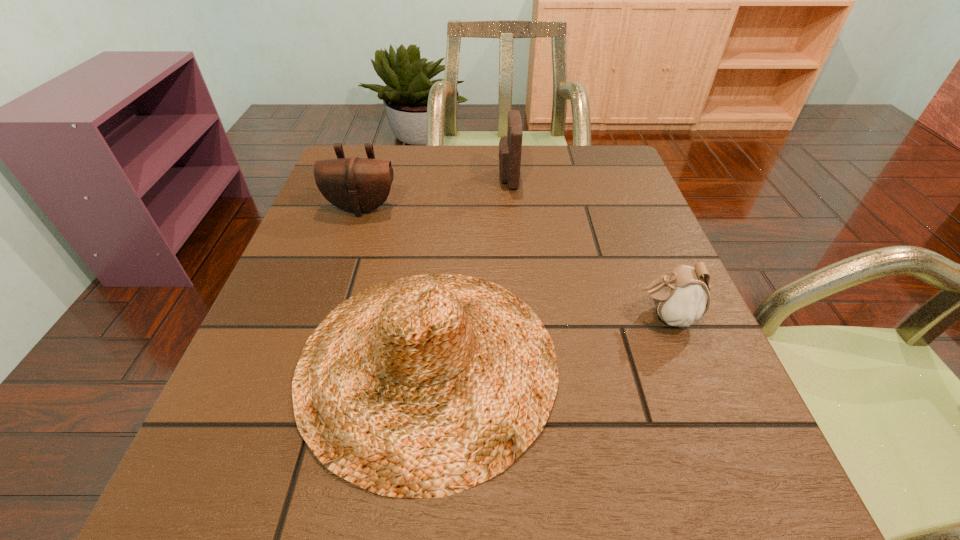
Identify the location of object that is at the near left corner. (421, 387).

In order to click on free spot at the far edge of the desktop in this screenshot , I will do `click(412, 170)`.

Find the location of a particular element. free spot at the near edge of the desktop is located at coordinates (536, 524).

Find the location of a particular element. Image resolution: width=960 pixels, height=540 pixels. free space at the left edge of the desktop is located at coordinates (339, 283).

At what (x,y) coordinates should I click in order to perform the action: click on vacant space at the right edge of the desktop. Please return your answer as a coordinate pair (x, y). Looking at the image, I should click on (684, 394).

The image size is (960, 540). In the image, there is a desktop. What are the coordinates of `vacant space at the near left corner` in the screenshot? It's located at (240, 472).

The width and height of the screenshot is (960, 540). In order to click on vacant space at the far right corner of the desktop in this screenshot , I will do `click(628, 170)`.

I want to click on vacant space at the near right corner, so click(x=796, y=523).

Identify the location of free spot between the second pouch from left to right and the shortest object. (587, 247).

This screenshot has width=960, height=540. I want to click on free space between the farthest object and the second nearest pouch, so click(x=435, y=193).